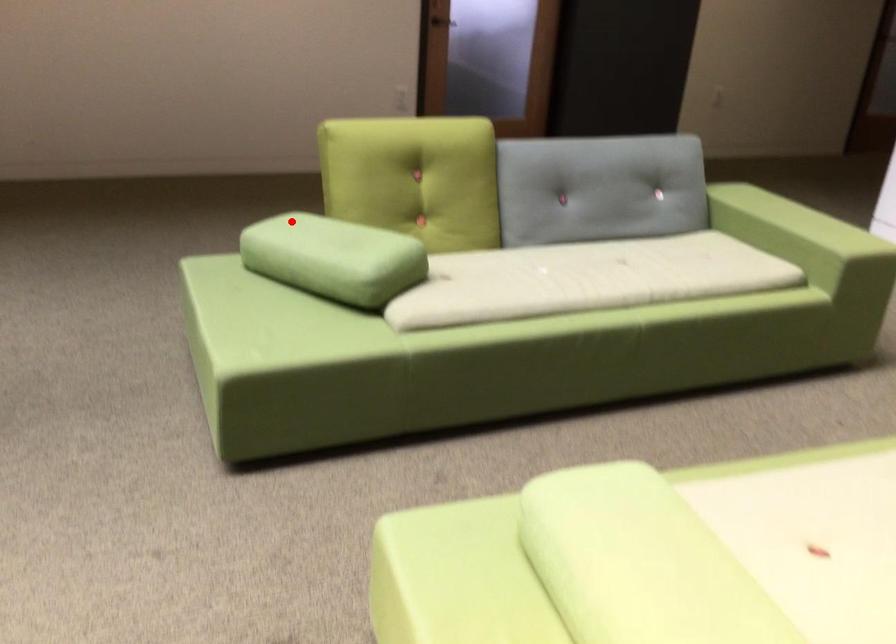
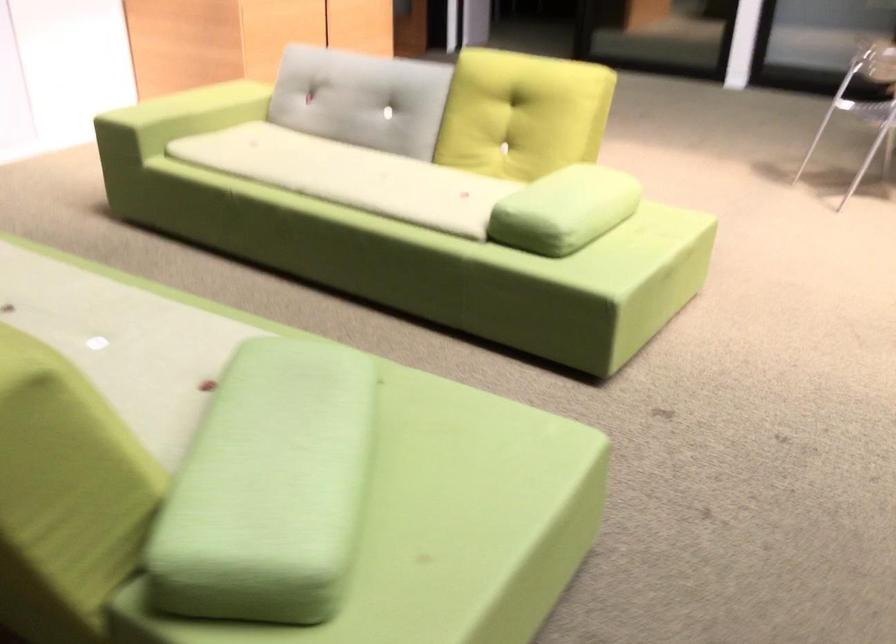
Question: I am providing you with two images of the same scene from different viewpoints. A red point is marked on the first image. At the location where the point appears in image 1, is it still visible in image 2?

Choices:
 (A) Yes
 (B) No

Answer: (A)